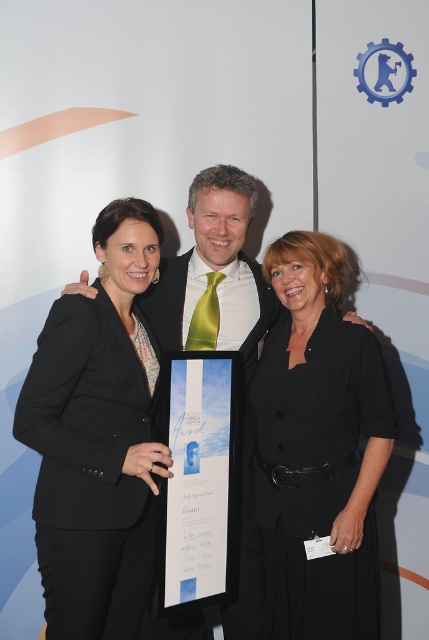
Which is more to the right, black suit at left or green satin tie at center?

green satin tie at center is more to the right.

Which of these two, black suit at left or green satin tie at center, stands shorter?

With less height is green satin tie at center.

Identify the location of black suit at left. The width and height of the screenshot is (429, 640). (96, 436).

What do you see at coordinates (317, 449) in the screenshot? This screenshot has height=640, width=429. I see `black matte dress at center` at bounding box center [317, 449].

Can you confirm if black matte dress at center is taller than green satin tie at center?

Yes, black matte dress at center is taller than green satin tie at center.

Consider the image. Who is more distant from viewer, (344,250) or (87,292)?

Positioned behind is point (344,250).

Locate an element on the screen. This screenshot has height=640, width=429. black matte dress at center is located at coordinates (317, 449).

Who is more distant from viewer, (114,346) or (262,428)?

Positioned behind is point (262,428).

Does black suit at left lie behind black matte dress at center?

No.

Image resolution: width=429 pixels, height=640 pixels. Describe the element at coordinates (96, 436) in the screenshot. I see `black suit at left` at that location.

Identify the location of black suit at left. (96, 436).